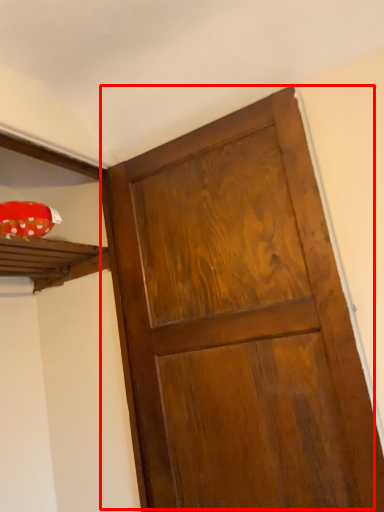
Question: Where is door (annotated by the red box) located in relation to shelf in the image?

Choices:
 (A) left
 (B) right

Answer: (B)